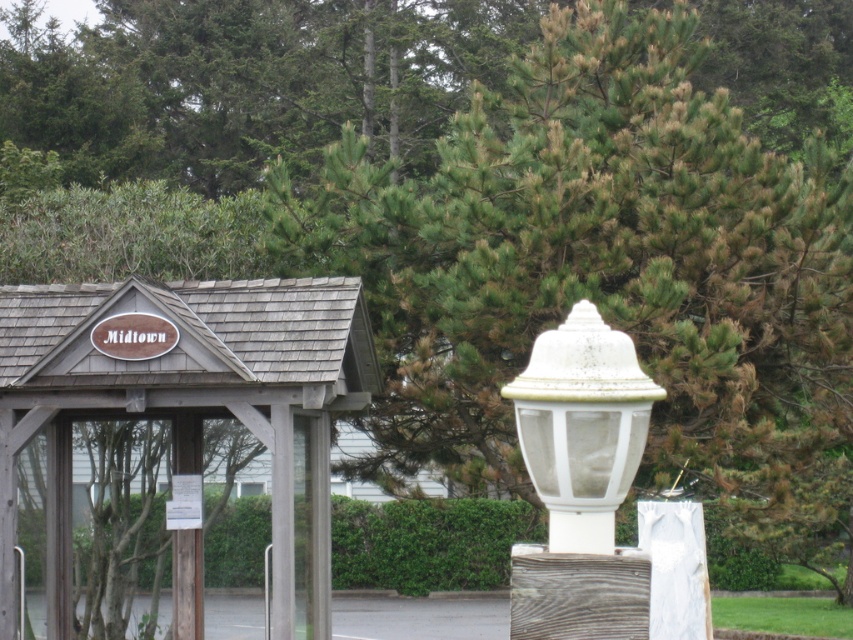
You are a delivery person trying to read the wooden sign at center and the white matte lamp post at center from across the street. Which object is bigger in size?

The wooden sign at center has a larger size compared to the white matte lamp post at center, so the wooden sign at center is bigger.

In the scene shown: You are a city planner evaluating the placement of the wooden sign at center and the white matte lamp post at center in the Midtown bus stop area. Based on their heights, which object would likely block the view of the other when standing directly in front of them?

The wooden sign at center is taller than the white matte lamp post at center, so it would likely block the view of the lamp post when standing directly in front of them.